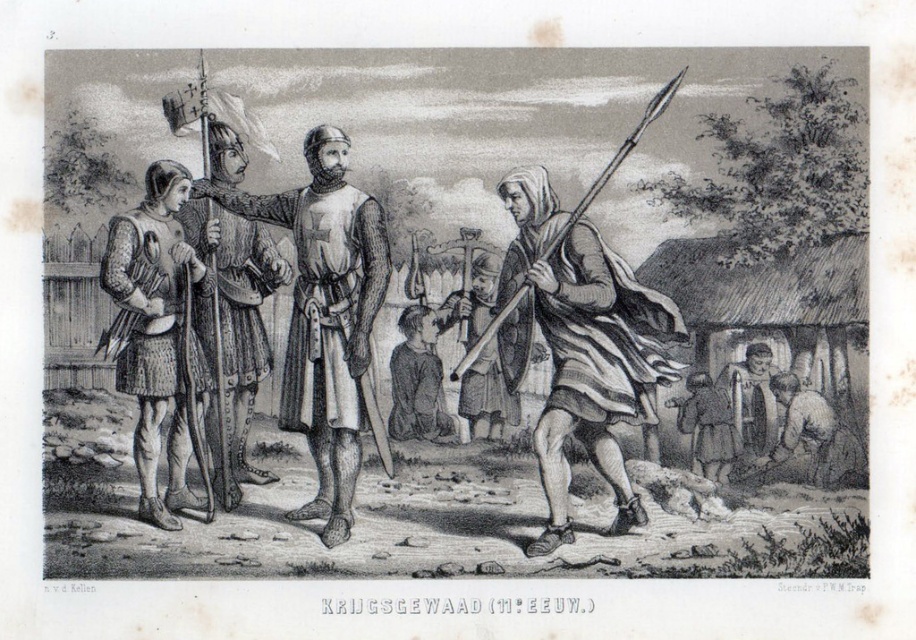
In the medieval scene, there are two items of interest. You see the chainmail armor at left and the brown leather bag at lower right. Which object is wider?

The chainmail armor at left is wider than the brown leather bag at lower right.